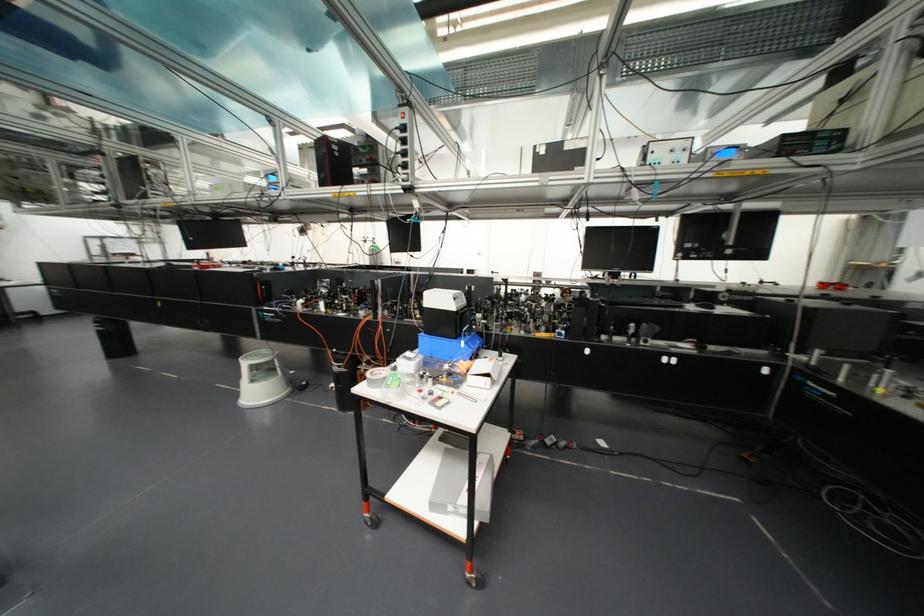
This screenshot has height=616, width=924. Identify the location of small white box. (462, 485).